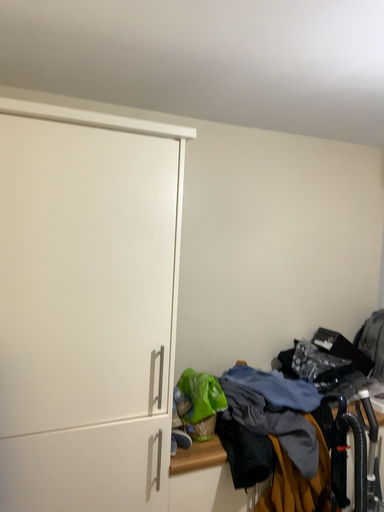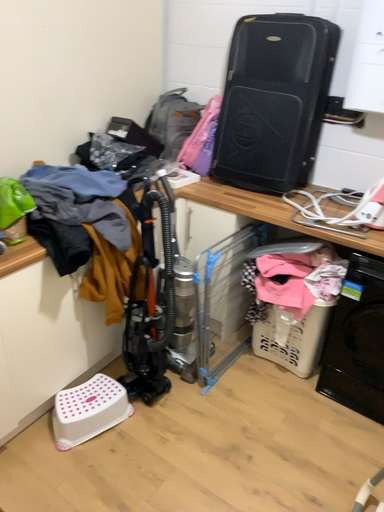
Question: Which way did the camera rotate in the video?

Choices:
 (A) rotated upward
 (B) rotated downward

Answer: (B)